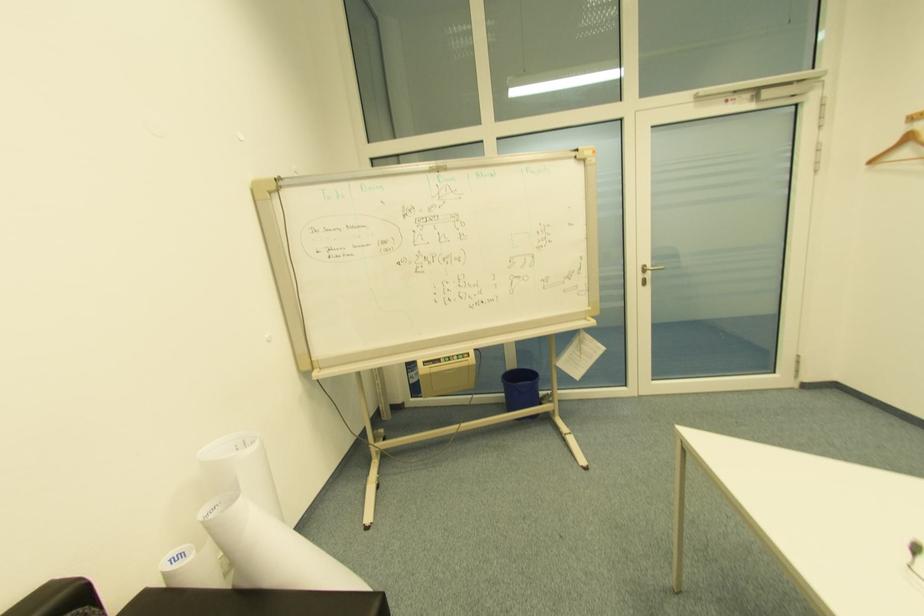
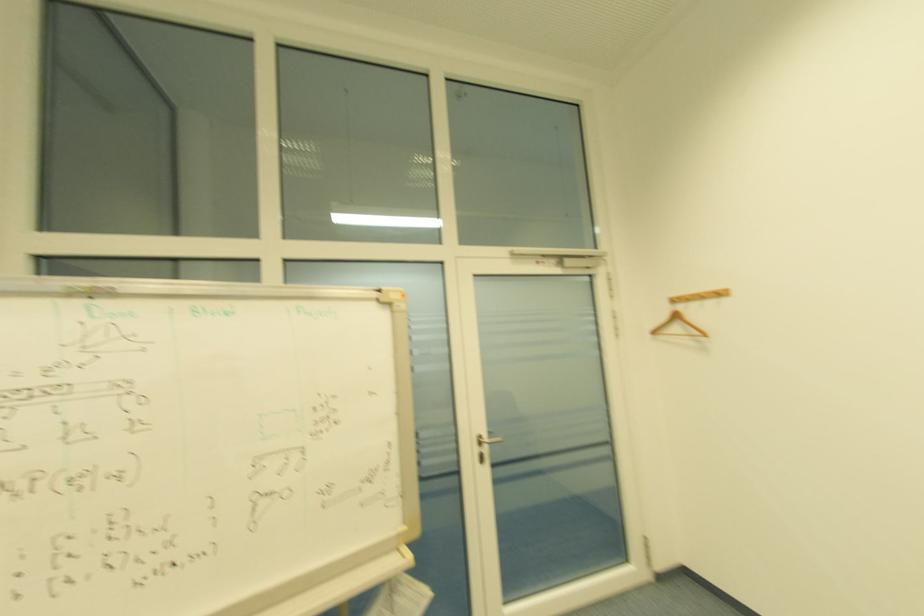
The images are taken continuously from a first-person perspective. In which direction is your viewpoint rotating?

The camera's rotation is toward right-up.